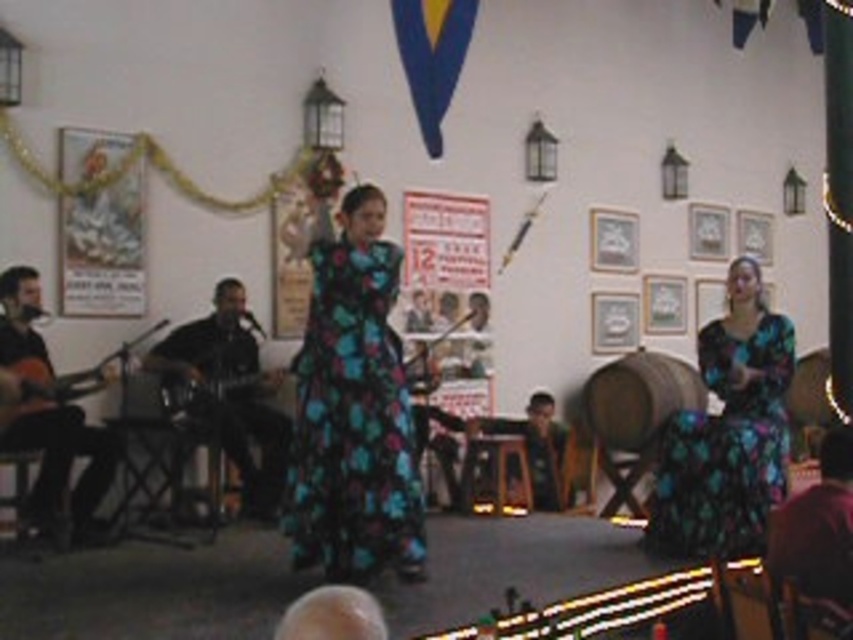
Question: Considering the real-world distances, which object is farthest from the wooden acoustic guitar at left?

Choices:
 (A) metallic electric guitar at left
 (B) floral-patterned fabric dress at right

Answer: (B)

Question: Is floral-patterned fabric dress at center wider than dark brown leather guitar at left?

Choices:
 (A) yes
 (B) no

Answer: (B)

Question: From the image, what is the correct spatial relationship of floral-patterned fabric dress at center in relation to brown leather jacket at lower right?

Choices:
 (A) below
 (B) above

Answer: (B)

Question: Which object is farther from the camera taking this photo?

Choices:
 (A) wooden acoustic guitar at left
 (B) floral-patterned fabric dress at center
 (C) matte brown guitar at left

Answer: (C)

Question: Does floral-patterned fabric dress at right appear under wooden acoustic guitar at left?

Choices:
 (A) no
 (B) yes

Answer: (B)

Question: Among these points, which one is nearest to the camera?

Choices:
 (A) (834, 520)
 (B) (73, 419)
 (C) (389, 472)
 (D) (202, 413)

Answer: (A)